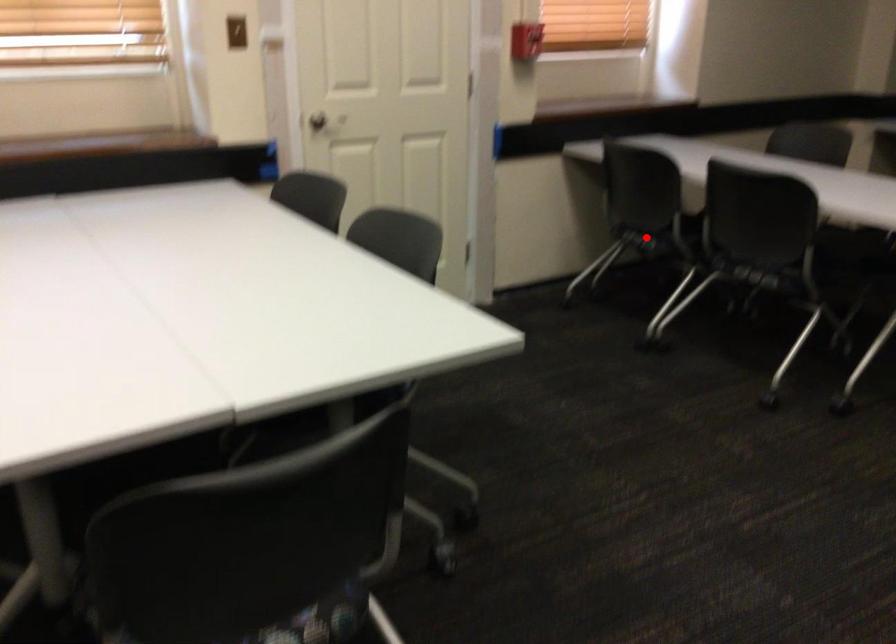
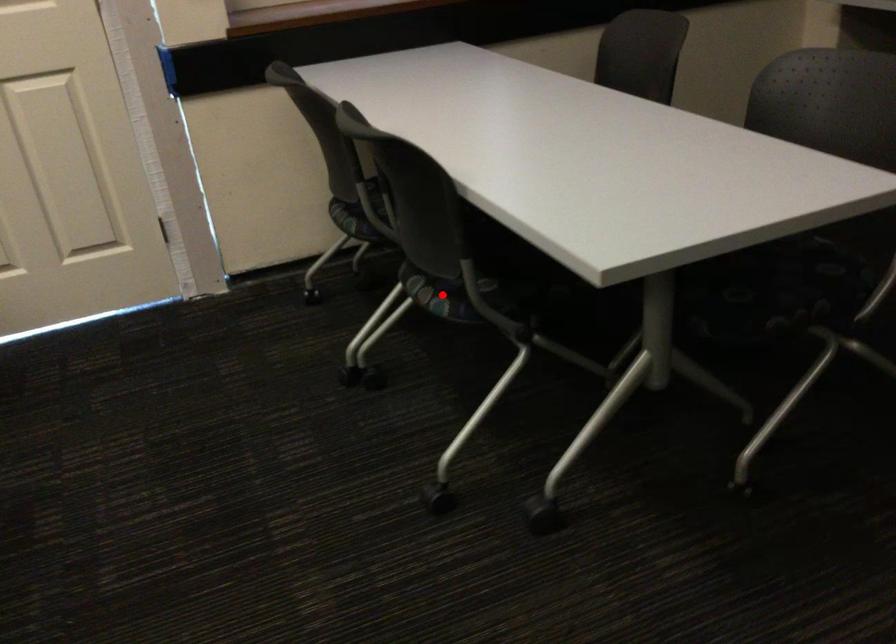
I am providing you with two images of the same scene from different viewpoints. A red point is marked on the first image and another point is marked on the second image. Are the points marked in image1 and image2 representing the same 3D position?

No